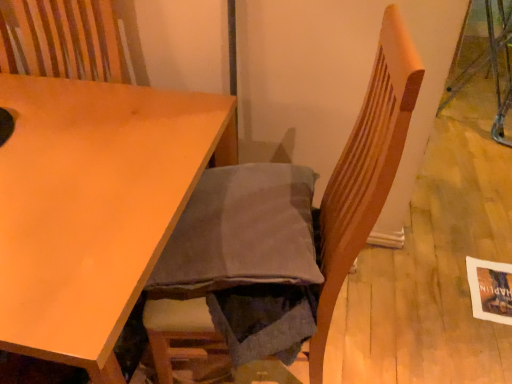
Locate an element on the screen. The height and width of the screenshot is (384, 512). matte wood table at center is located at coordinates (93, 206).

Measure the distance between point (39, 148) and camera.

Point (39, 148) and camera are 38.03 inches apart.

The width and height of the screenshot is (512, 384). What do you see at coordinates (93, 206) in the screenshot?
I see `matte wood table at center` at bounding box center [93, 206].

This screenshot has height=384, width=512. Describe the element at coordinates (367, 168) in the screenshot. I see `wooden chair at center` at that location.

At what (x,y) coordinates should I click in order to perform the action: click on wooden chair at center. Please return your answer as a coordinate pair (x, y). The height and width of the screenshot is (384, 512). Looking at the image, I should click on (367, 168).

What are the coordinates of `matte wood table at center` in the screenshot? It's located at (93, 206).

Considering the positions of objects matte wood table at center and wooden chair at center in the image provided, who is more to the right, matte wood table at center or wooden chair at center?

wooden chair at center.

In the image, is matte wood table at center positioned in front of or behind wooden chair at center?

matte wood table at center is behind wooden chair at center.

Which point is more forward, (0, 220) or (400, 154)?

The point (400, 154) is closer to the camera.

From the image's perspective, would you say matte wood table at center is shown under wooden chair at center?

Yes, from the image's perspective, matte wood table at center is below wooden chair at center.

From a real-world perspective, which is physically below, matte wood table at center or wooden chair at center?

matte wood table at center is physically lower.

Between matte wood table at center and wooden chair at center, which one has larger width?

With larger width is matte wood table at center.

In terms of height, does matte wood table at center look taller or shorter compared to wooden chair at center?

matte wood table at center is shorter than wooden chair at center.

Is matte wood table at center bigger or smaller than wooden chair at center?

Clearly, matte wood table at center is larger in size than wooden chair at center.

Can we say matte wood table at center lies outside wooden chair at center?

Absolutely, matte wood table at center is external to wooden chair at center.

Is there a large distance between matte wood table at center and wooden chair at center?

That's not correct — matte wood table at center is a little close to wooden chair at center.

Is matte wood table at center looking in the opposite direction of wooden chair at center?

matte wood table at center is not turned away from wooden chair at center.

Find the location of a particular element. Image resolution: width=512 pixels, height=384 pixels. table that is behind the wooden chair at center is located at coordinates (93, 206).

Considering the relative positions of wooden chair at center and matte wood table at center in the image provided, is wooden chair at center to the left of matte wood table at center from the viewer's perspective?

No.

Considering their positions, is wooden chair at center located in front of or behind matte wood table at center?

Clearly, wooden chair at center is in front of matte wood table at center.

Is point (352, 235) farther from viewer compared to point (14, 206)?

No, it is not.

From the image's perspective, which is above, wooden chair at center or matte wood table at center?

wooden chair at center is shown above in the image.

From a real-world perspective, who is located higher, wooden chair at center or matte wood table at center?

wooden chair at center is physically above.

Which of these two, wooden chair at center or matte wood table at center, is thinner?

Thinner between the two is wooden chair at center.

Based on the photo, which of these two, wooden chair at center or matte wood table at center, stands shorter?

With less height is matte wood table at center.

Which of these two, wooden chair at center or matte wood table at center, is smaller?

Smaller between the two is wooden chair at center.

Is wooden chair at center outside of matte wood table at center?

Yes, wooden chair at center is outside of matte wood table at center.

Is there a large distance between wooden chair at center and matte wood table at center?

No, wooden chair at center is in close proximity to matte wood table at center.

Based on the photo, is wooden chair at center oriented away from matte wood table at center?

That's not correct — wooden chair at center is not looking away from matte wood table at center.

You are a GUI agent. You are given a task and a screenshot of the screen. Output one action in this format:
    pyautogui.click(x=<x>, y=<y>)
    Task: Click on the table that appears on the left of wooden chair at center
    This screenshot has height=384, width=512.
    Given the screenshot: What is the action you would take?
    pyautogui.click(x=93, y=206)

At what (x,y) coordinates should I click in order to perform the action: click on table that appears on the left of wooden chair at center. Please return your answer as a coordinate pair (x, y). Looking at the image, I should click on (93, 206).

Where is `chair that appears on the right of matte wood table at center`? The width and height of the screenshot is (512, 384). chair that appears on the right of matte wood table at center is located at coordinates (367, 168).